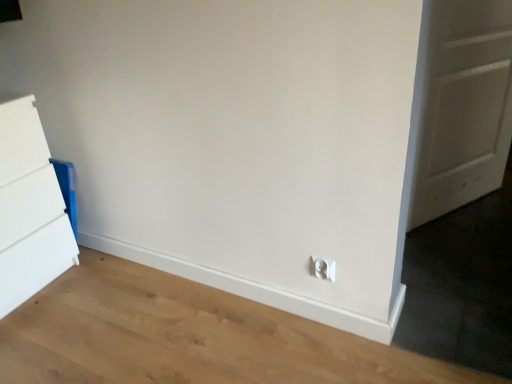
Image resolution: width=512 pixels, height=384 pixels. What do you see at coordinates (323, 268) in the screenshot? I see `white plastic electric outlet at lower right` at bounding box center [323, 268].

Where is `white plastic electric outlet at lower right`? white plastic electric outlet at lower right is located at coordinates (323, 268).

Image resolution: width=512 pixels, height=384 pixels. I want to click on white plastic electric outlet at lower right, so pyautogui.click(x=323, y=268).